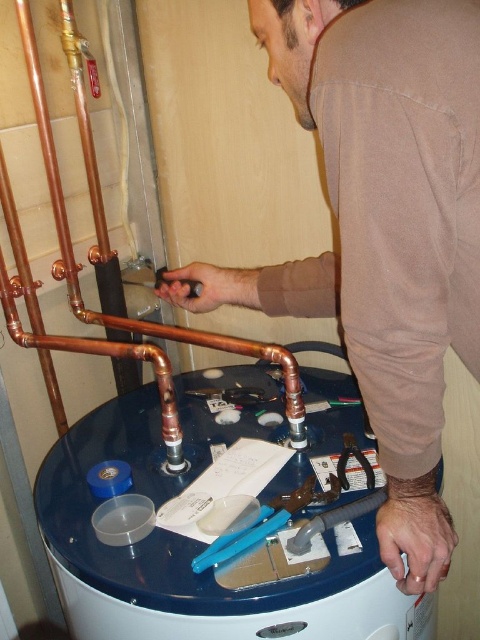
You are standing in front of the water heater and want to pick up an object. The first object is at point (208,268) and the second is at point (70,246). Which point is closer to you?

Point (208,268) is closer to the camera than point (70,246), so you should pick up the object at point (208,268) first as it is nearer to you.

You are standing in front of the water heater and want to reach two points marked on it. The first point is at coordinate point(464, 193) and the second point is at coordinate point(72, 506). Which point will you need to extend your arm less to reach?

Point(464, 193) is closer to the camera than point(72, 506), so you will need to extend your arm less to reach point(464, 193).